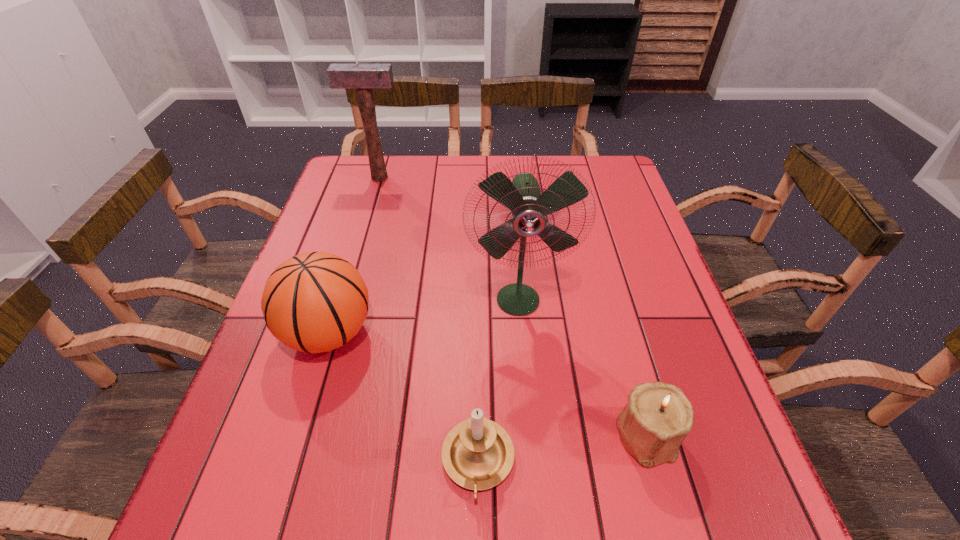
Find the location of a particular element. The image size is (960, 540). free space between the fan and the basketball is located at coordinates (423, 316).

Find the location of a particular element. This screenshot has height=540, width=960. empty space between the left candle_holder and the farthest object is located at coordinates (429, 320).

The width and height of the screenshot is (960, 540). I want to click on free space between the farthest object and the third tallest object, so click(x=354, y=255).

What are the coordinates of `vacant area that lies between the mallet and the third tallest object` in the screenshot? It's located at (354, 255).

Where is `free space between the mallet and the left candle_holder`? The width and height of the screenshot is (960, 540). free space between the mallet and the left candle_holder is located at coordinates pyautogui.click(x=429, y=320).

What are the coordinates of `free area in between the farthest object and the third shortest object` in the screenshot? It's located at (354, 255).

Where is `free spot between the third tallest object and the fan`? This screenshot has width=960, height=540. free spot between the third tallest object and the fan is located at coordinates (423, 316).

At what (x,y) coordinates should I click in order to perform the action: click on vacant area that lies between the left candle_holder and the basketball. Please return your answer as a coordinate pair (x, y). Looking at the image, I should click on (403, 398).

The width and height of the screenshot is (960, 540). Identify the location of blank region between the right candle_holder and the fan. (582, 367).

I want to click on unoccupied position between the fan and the right candle_holder, so click(x=582, y=367).